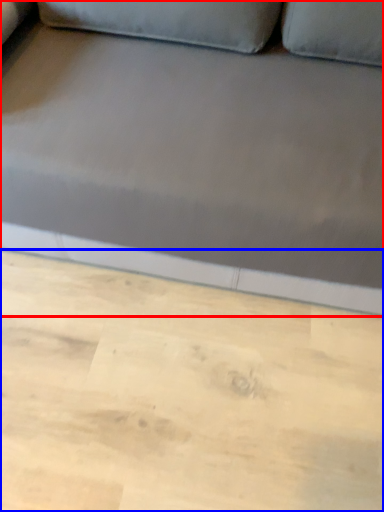
Question: Which point is further to the camera, studio couch (highlighted by a red box) or plywood (highlighted by a blue box)?

Choices:
 (A) studio couch
 (B) plywood

Answer: (B)